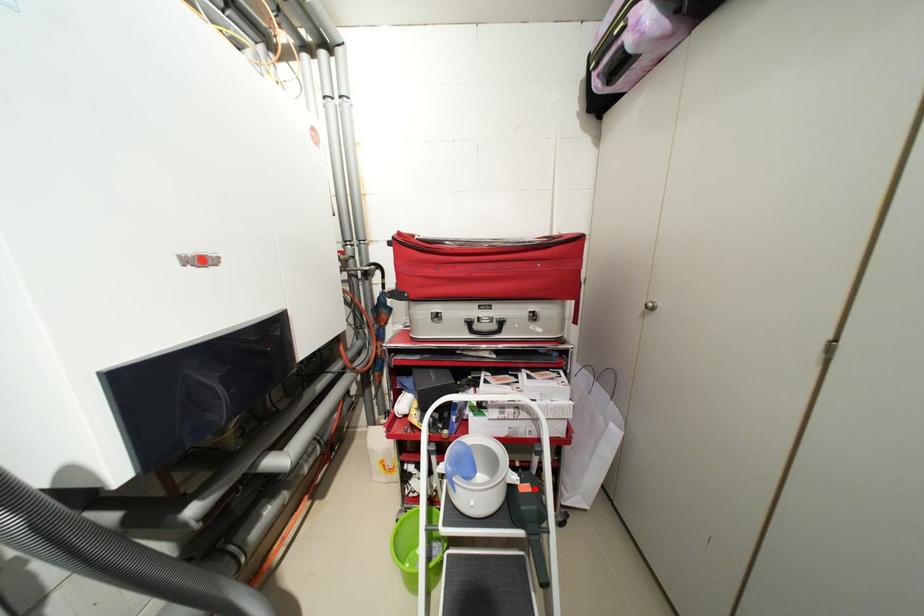
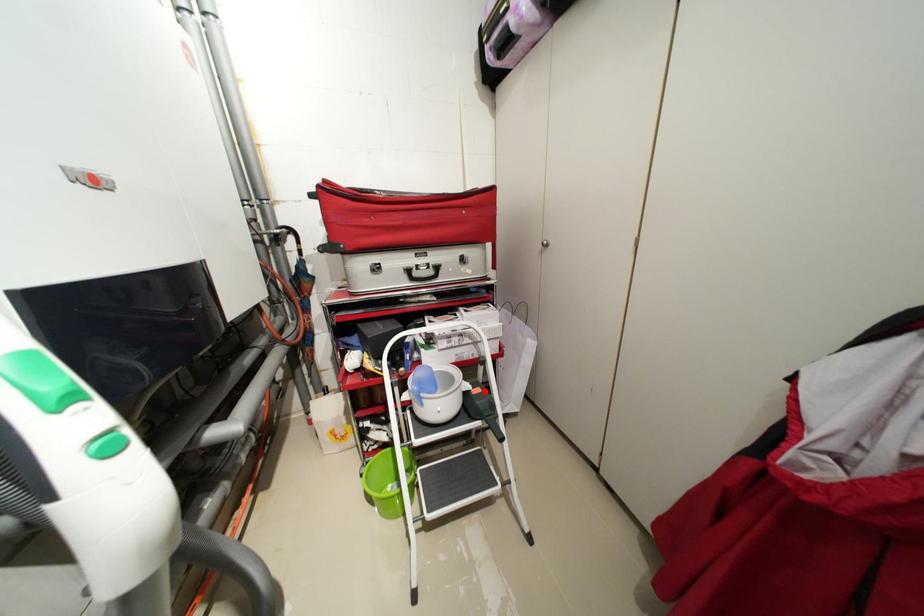
I am providing you with two images of the same scene from different viewpoints. A red point is marked on the first image and another point is marked on the second image. Is the marked point in image1 the same physical position as the marked point in image2?

Yes